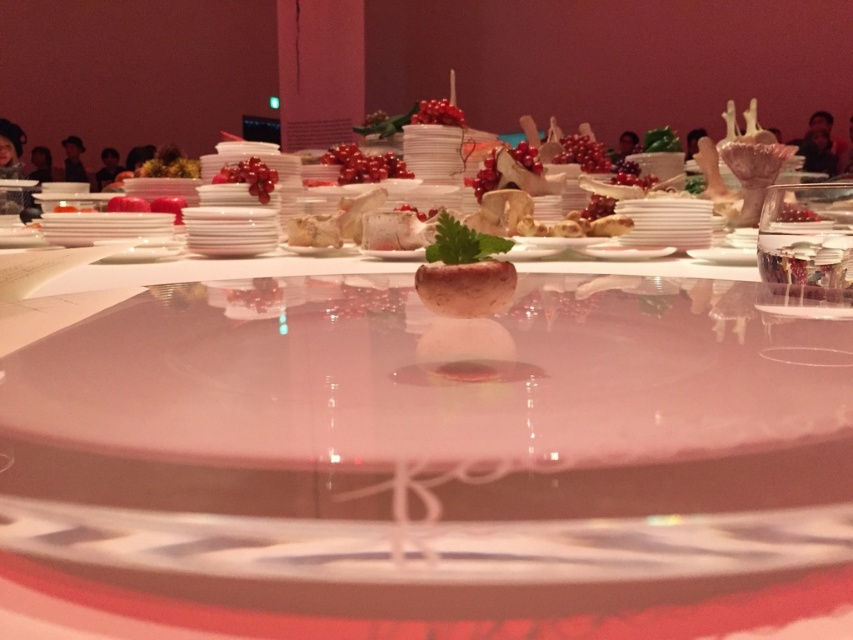
Who is taller, shiny red berries at upper center or glossy red berries at center?

Standing taller between the two is glossy red berries at center.

Between point (263, 184) and point (424, 99), which one is positioned in front?

Point (263, 184)

Is point (274, 180) farther from camera compared to point (410, 122)?

No, it is in front of (410, 122).

This screenshot has height=640, width=853. I want to click on shiny red berries at upper center, so click(x=248, y=177).

Is clear acrylic table at center further to camera compared to shiny red berries at upper center?

No.

Which is in front, point (82, 625) or point (260, 195)?

Point (82, 625) is more forward.

You are a GUI agent. You are given a task and a screenshot of the screen. Output one action in this format:
    pyautogui.click(x=<x>, y=<y>)
    Task: Click on the clear acrylic table at center
    
    Given the screenshot: What is the action you would take?
    pyautogui.click(x=425, y=461)

Identify the location of clear acrylic table at center. (425, 461).

Does shiny red berries at center have a larger size compared to glossy red berries at center?

Correct, shiny red berries at center is larger in size than glossy red berries at center.

Is shiny red berries at center further to the viewer compared to glossy red berries at center?

No, shiny red berries at center is closer to the viewer.

Is point (370, 156) closer to camera compared to point (416, 124)?

Yes, it is.

The image size is (853, 640). In order to click on shiny red berries at center in this screenshot , I will do `click(363, 164)`.